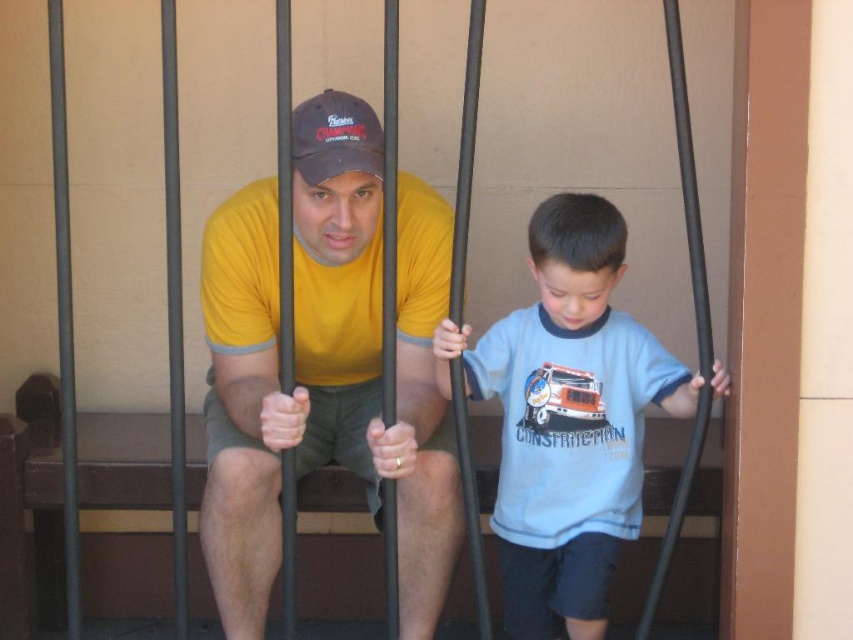
Between point (560, 410) and point (320, 154), which one is positioned behind?

Positioned behind is point (560, 410).

Is light blue cotton shirt at center positioned at the back of matte black baseball cap at center?

Yes, it is.

Image resolution: width=853 pixels, height=640 pixels. What are the coordinates of `light blue cotton shirt at center` in the screenshot? It's located at (567, 419).

You are a GUI agent. You are given a task and a screenshot of the screen. Output one action in this format:
    pyautogui.click(x=<x>, y=<y>)
    Task: Click on the light blue cotton shirt at center
    
    Given the screenshot: What is the action you would take?
    pyautogui.click(x=567, y=419)

Identify the location of yellow matte t-shirt at center. [x=325, y=364].

Can you confirm if yellow matte t-shirt at center is positioned to the right of light blue cotton shirt at center?

Incorrect, yellow matte t-shirt at center is not on the right side of light blue cotton shirt at center.

The width and height of the screenshot is (853, 640). What are the coordinates of `yellow matte t-shirt at center` in the screenshot? It's located at (325, 364).

Who is more distant from viewer, (257, 202) or (291, 120)?

Point (257, 202)

Can you confirm if yellow matte t-shirt at center is positioned to the right of matte black baseball cap at center?

In fact, yellow matte t-shirt at center is to the left of matte black baseball cap at center.

Between point (223, 540) and point (335, 93), which one is positioned behind?

Point (223, 540)

Locate an element on the screen. The image size is (853, 640). yellow matte t-shirt at center is located at coordinates (325, 364).